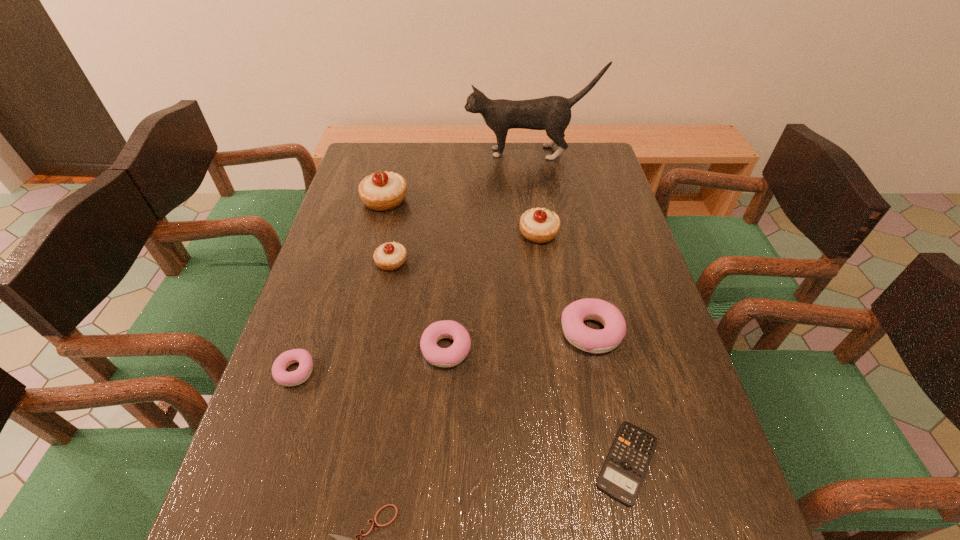
This screenshot has height=540, width=960. Identify the location of free space that is in between the fourth farthest object and the third pastry from right to left. (419, 306).

Identify which object is located as the fifth nearest to the shortest pastry. Please provide its 2D coordinates. Your answer should be formatted as a tuple, i.e. [(x, y)], where the tuple contains the x and y coordinates of a point satisfying the conditions above.

[(576, 332)]

Select which object appears as the second closest to the biggest beige pastry. Please provide its 2D coordinates. Your answer should be formatted as a tuple, i.e. [(x, y)], where the tuple contains the x and y coordinates of a point satisfying the conditions above.

[(552, 113)]

Where is `pastry that is the fourth nearest to the fourth shortest object`? This screenshot has height=540, width=960. pastry that is the fourth nearest to the fourth shortest object is located at coordinates (539, 225).

Where is `the second closest pastry relative to the second shortest pastry`? This screenshot has height=540, width=960. the second closest pastry relative to the second shortest pastry is located at coordinates (576, 332).

In order to click on beige pastry that can be found as the closest to the third farthest pastry in this screenshot , I will do `click(381, 191)`.

Locate which beige pastry is the second closest to the farthest beige pastry. Please provide its 2D coordinates. Your answer should be formatted as a tuple, i.e. [(x, y)], where the tuple contains the x and y coordinates of a point satisfying the conditions above.

[(539, 225)]

Point out which pink pastry is positioned as the nearest to the eighth tallest object. Please provide its 2D coordinates. Your answer should be formatted as a tuple, i.e. [(x, y)], where the tuple contains the x and y coordinates of a point satisfying the conditions above.

[(576, 332)]

Point out which pink pastry is positioned as the nearest to the sixth tallest object. Please provide its 2D coordinates. Your answer should be formatted as a tuple, i.e. [(x, y)], where the tuple contains the x and y coordinates of a point satisfying the conditions above.

[(576, 332)]

Identify the location of vacant space that satisfies the following two spatial constraints: 1. at the face of the farthest object; 2. on the front side of the second pink pastry from right to left. The height and width of the screenshot is (540, 960). [559, 349].